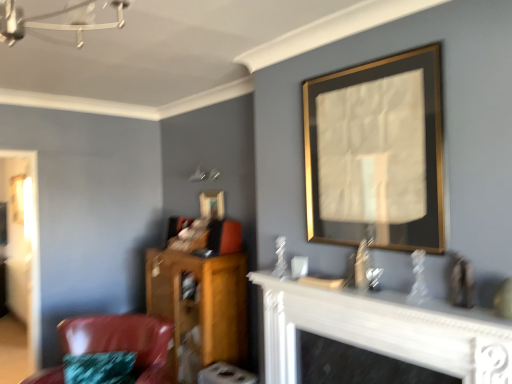
Question: Considering the relative positions of white glossy fireplace at lower center and gold-framed mirror at upper center, positioned as the 1th picture frame in left-to-right order, in the image provided, is white glossy fireplace at lower center to the left of gold-framed mirror at upper center, positioned as the 1th picture frame in left-to-right order, from the viewer's perspective?

Choices:
 (A) no
 (B) yes

Answer: (A)

Question: From the image's perspective, is white glossy fireplace at lower center located beneath gold-framed mirror at upper center, which appears as the first picture frame when viewed from the back?

Choices:
 (A) yes
 (B) no

Answer: (A)

Question: Is the position of white glossy fireplace at lower center more distant than that of gold-framed mirror at upper center, acting as the 2th picture frame starting from the front?

Choices:
 (A) no
 (B) yes

Answer: (A)

Question: From a real-world perspective, is white glossy fireplace at lower center over gold-framed mirror at upper center, acting as the 2th picture frame starting from the front?

Choices:
 (A) no
 (B) yes

Answer: (A)

Question: Considering the relative sizes of white glossy fireplace at lower center and gold-framed mirror at upper center, placed as the 2th picture frame when sorted from right to left, in the image provided, is white glossy fireplace at lower center thinner than gold-framed mirror at upper center, placed as the 2th picture frame when sorted from right to left,?

Choices:
 (A) yes
 (B) no

Answer: (B)

Question: From a real-world perspective, relative to white glossy fireplace at lower center, is wooden cabinet at lower left vertically above or below?

Choices:
 (A) below
 (B) above

Answer: (A)

Question: From their relative heights in the image, would you say wooden cabinet at lower left is taller or shorter than white glossy fireplace at lower center?

Choices:
 (A) tall
 (B) short

Answer: (A)

Question: Looking at their shapes, would you say wooden cabinet at lower left is wider or thinner than white glossy fireplace at lower center?

Choices:
 (A) thin
 (B) wide

Answer: (B)

Question: From the image's perspective, is wooden cabinet at lower left positioned above or below white glossy fireplace at lower center?

Choices:
 (A) above
 (B) below

Answer: (B)

Question: From the image's perspective, is white glossy fireplace at lower center positioned above or below wooden cabinet at lower left?

Choices:
 (A) below
 (B) above

Answer: (B)

Question: Based on their positions, is white glossy fireplace at lower center located to the left or right of wooden cabinet at lower left?

Choices:
 (A) right
 (B) left

Answer: (A)

Question: Is white glossy fireplace at lower center in front of or behind wooden cabinet at lower left in the image?

Choices:
 (A) front
 (B) behind

Answer: (A)

Question: From a real-world perspective, is white glossy fireplace at lower center above or below wooden cabinet at lower left?

Choices:
 (A) above
 (B) below

Answer: (A)

Question: Is white glossy fireplace at lower center inside the boundaries of shiny leather chair at lower left, or outside?

Choices:
 (A) inside
 (B) outside

Answer: (B)

Question: In terms of size, does white glossy fireplace at lower center appear bigger or smaller than shiny leather chair at lower left?

Choices:
 (A) small
 (B) big

Answer: (A)